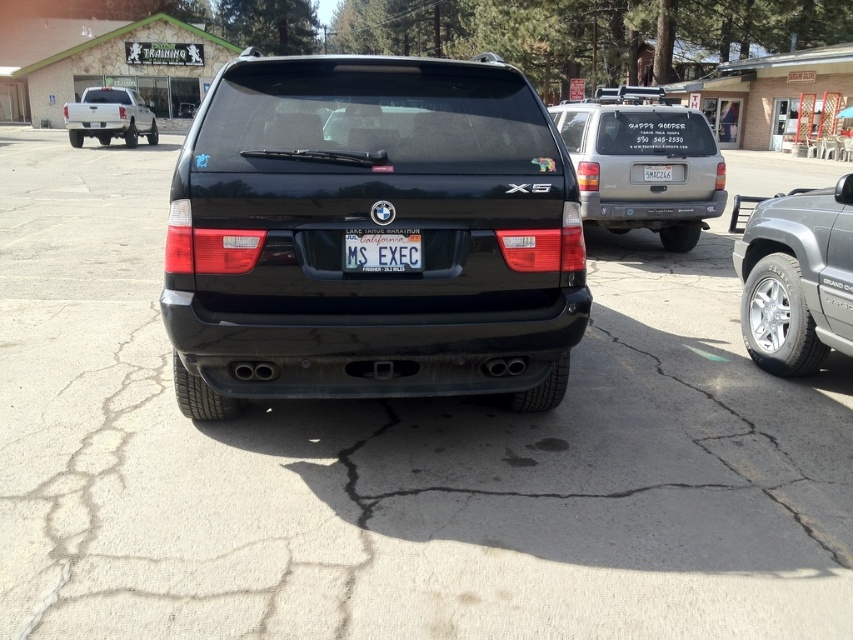
Is silver metallic suv at upper right closer to the viewer compared to white matte truck at upper left?

Yes, it is in front of white matte truck at upper left.

At what (x,y) coordinates should I click in order to perform the action: click on silver metallic suv at upper right. Please return your answer as a coordinate pair (x, y). The width and height of the screenshot is (853, 640). Looking at the image, I should click on (643, 163).

In the scene shown: Can you confirm if black matte suv at center is positioned to the right of white matte truck at upper left?

Yes, black matte suv at center is to the right of white matte truck at upper left.

Between black matte suv at center and white matte truck at upper left, which one appears on the left side from the viewer's perspective?

Positioned to the left is white matte truck at upper left.

Is point (395, 90) less distant than point (67, 122)?

Yes, it is in front of point (67, 122).

Locate an element on the screen. black matte suv at center is located at coordinates (370, 228).

Between point (555, 132) and point (611, 172), which one is positioned behind?

Point (611, 172)

Who is taller, black matte suv at center or silver metallic suv at upper right?

silver metallic suv at upper right is taller.

Identify the location of black matte suv at center. The width and height of the screenshot is (853, 640). (370, 228).